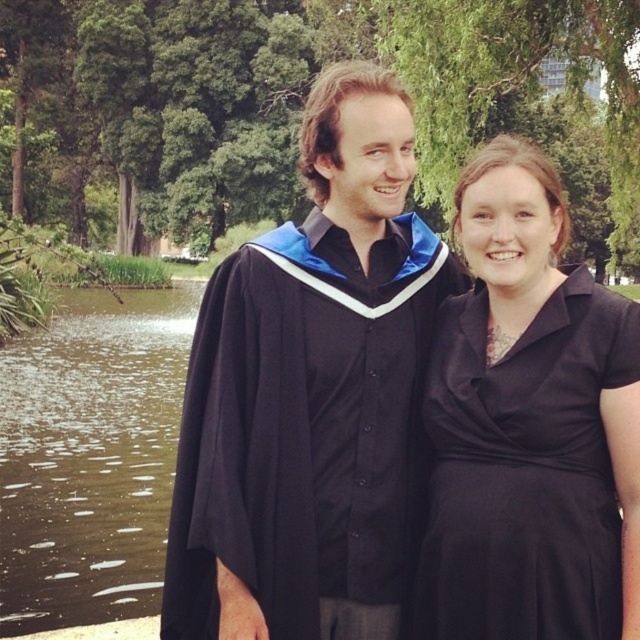
You are organizing a formal event and need to ensure that both the black matte graduation gown at center and the black satin dress at center can fit side by side on a standard coat rack. Given that the coat rack has a width of 1.2 meters, can both items be accommodated comfortably?

The black matte graduation gown at center is larger in size than the black satin dress at center. However, without specific measurements of their individual widths, it is impossible to determine if they can fit comfortably on a 1.2 meter coat rack. Additional information about their dimensions is required.

Consider the image. You are a photographer planning to take a portrait of both the black matte graduation gown at center and the black satin dress at center. Since you want to ensure both subjects are fully visible in the frame, which subject should you position closer to the camera to maintain their visibility?

The black satin dress at center should be positioned closer to the camera because it is shorter than the black matte graduation gown at center, ensuring both subjects remain visible in the frame.

You are a photographer trying to capture both the black matte graduation gown at center and the black satin dress at center in a single shot. Which one should you focus on first to ensure clarity in your photo?

You should focus on the black matte graduation gown at center first because it is closer to you than the black satin dress at center, ensuring it remains sharp while the background may blur slightly.